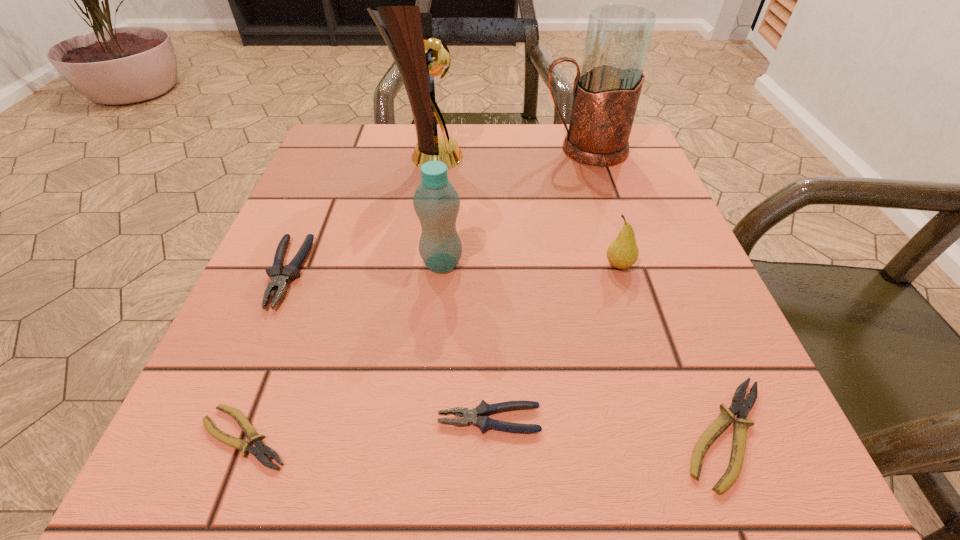
At what (x,y) coordinates should I click in order to perform the action: click on free point located at the gripping part of the second pliers from right to left. Please return your answer as a coordinate pair (x, y). Image resolution: width=960 pixels, height=540 pixels. Looking at the image, I should click on (252, 420).

Where is `vacant space located 0.050m at the gripping part of the second pliers from right to left`? The height and width of the screenshot is (540, 960). vacant space located 0.050m at the gripping part of the second pliers from right to left is located at coordinates (398, 420).

Find the location of a particular element. Image resolution: width=960 pixels, height=540 pixels. free space located at the gripping part of the second pliers from right to left is located at coordinates (252, 420).

Locate an element on the screen. free space located 0.310m on the back of the bigger yellow pliers is located at coordinates (645, 231).

Locate an element on the screen. This screenshot has width=960, height=540. vacant area situated 0.060m on the back of the shortest pliers is located at coordinates (273, 366).

Find the location of a particular element. The image size is (960, 540). award present at the far edge is located at coordinates (419, 56).

The width and height of the screenshot is (960, 540). I want to click on pitcher that is at the far edge, so click(x=606, y=91).

The image size is (960, 540). Find the location of `pitcher located at the right edge`. pitcher located at the right edge is located at coordinates (606, 91).

The height and width of the screenshot is (540, 960). Find the location of `pear that is at the right edge`. pear that is at the right edge is located at coordinates (622, 253).

The width and height of the screenshot is (960, 540). I want to click on pliers that is at the right edge, so click(739, 405).